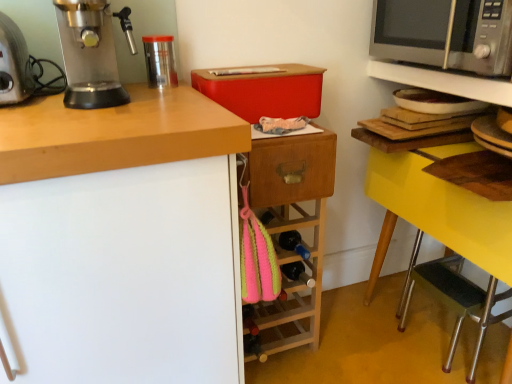
Question: Based on their sizes in the image, would you say satin silver microwave at upper right is bigger or smaller than wooden drawer at center?

Choices:
 (A) big
 (B) small

Answer: (A)

Question: In terms of height, does satin silver microwave at upper right look taller or shorter compared to wooden drawer at center?

Choices:
 (A) short
 (B) tall

Answer: (B)

Question: Which of these objects is positioned closest to the yellow wood table at right, acting as the first shelf starting from the bottom?

Choices:
 (A) metallic silver microwave at upper right, which appears as the second shelf when ordered from the bottom
 (B) black rubber step stool at lower right
 (C) silver metallic toaster at left
 (D) wooden drawer at center
 (E) satin silver microwave at upper right

Answer: (A)

Question: Which object is the closest to the metallic silver espresso machine at left?

Choices:
 (A) yellow wood table at right, acting as the first shelf starting from the bottom
 (B) satin silver microwave at upper right
 (C) metallic silver microwave at upper right, which appears as the second shelf when ordered from the bottom
 (D) wooden drawer at center
 (E) black rubber step stool at lower right

Answer: (D)